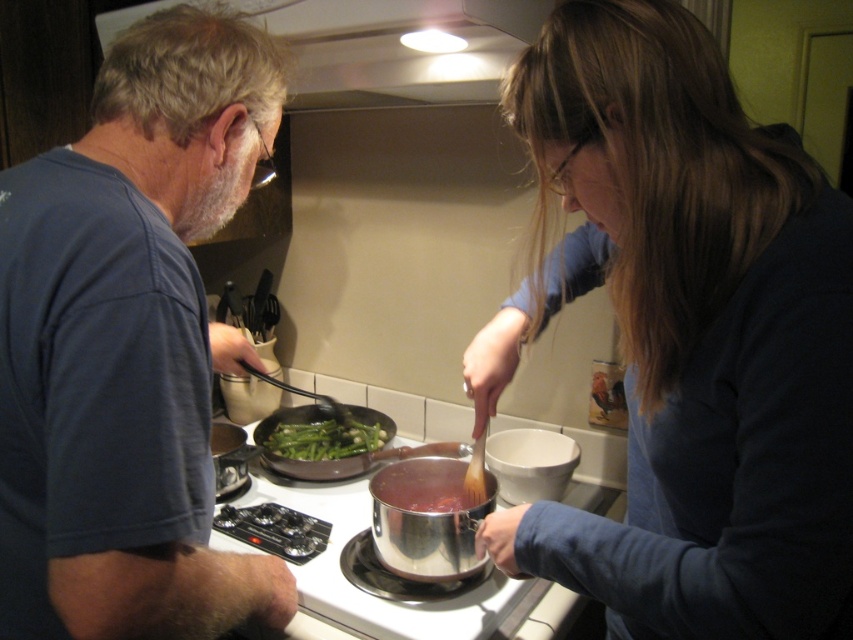
Is silver metallic pot at center taller than shiny metallic pot at center?

Correct, silver metallic pot at center is much taller as shiny metallic pot at center.

Is silver metallic pot at center thinner than shiny metallic pot at center?

Incorrect, silver metallic pot at center's width is not less than shiny metallic pot at center's.

Which is in front, point (357, 496) or point (381, 484)?

Positioned in front is point (381, 484).

Where is `silver metallic pot at center`? silver metallic pot at center is located at coordinates (370, 595).

Which is below, white glossy exhaust hood at upper center or shiny metallic pot at center?

shiny metallic pot at center is below.

Who is positioned more to the left, white glossy exhaust hood at upper center or shiny metallic pot at center?

white glossy exhaust hood at upper center is more to the left.

Is point (497, 72) less distant than point (405, 500)?

That is True.

At what (x,y) coordinates should I click in order to perform the action: click on white glossy exhaust hood at upper center. Please return your answer as a coordinate pair (x, y). Looking at the image, I should click on (381, 45).

Which is more to the right, matte blue shirt at center or blue cotton shirt at left?

Positioned to the right is matte blue shirt at center.

Can you confirm if matte blue shirt at center is shorter than blue cotton shirt at left?

In fact, matte blue shirt at center may be taller than blue cotton shirt at left.

The image size is (853, 640). Identify the location of matte blue shirt at center. (688, 336).

This screenshot has width=853, height=640. Find the location of `matte blue shirt at center`. matte blue shirt at center is located at coordinates (688, 336).